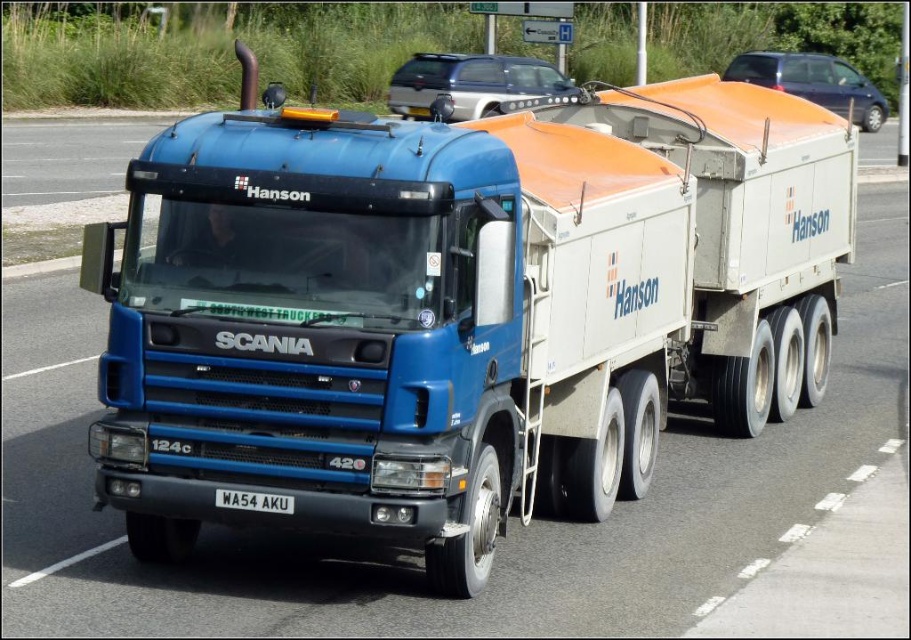
Who is shorter, silver metallic suv at upper center or metallic blue van at upper right?

metallic blue van at upper right

Which of these two, silver metallic suv at upper center or metallic blue van at upper right, stands taller?

With more height is silver metallic suv at upper center.

Is point (416, 81) in front of point (740, 61)?

Yes, it is.

Where is `silver metallic suv at upper center`? The image size is (911, 640). silver metallic suv at upper center is located at coordinates (469, 83).

Is metallic blue van at upper right to the left of white metallic license plate at center from the viewer's perspective?

No, metallic blue van at upper right is not to the left of white metallic license plate at center.

Which is in front, point (746, 52) or point (213, 499)?

Point (213, 499)

Between point (754, 77) and point (239, 500), which one is positioned behind?

Point (754, 77)

Locate an element on the screen. metallic blue van at upper right is located at coordinates (814, 83).

Does silver metallic suv at upper center have a larger size compared to white metallic license plate at center?

Yes.

In the scene shown: Who is higher up, silver metallic suv at upper center or white metallic license plate at center?

silver metallic suv at upper center

Is point (387, 86) positioned behind point (220, 488)?

Yes, point (387, 86) is farther from viewer.

At what (x,y) coordinates should I click in order to perform the action: click on silver metallic suv at upper center. Please return your answer as a coordinate pair (x, y). Looking at the image, I should click on (469, 83).